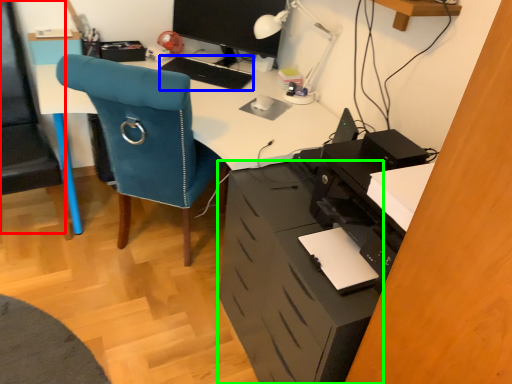
Question: Based on their relative distances, which object is farther from computer chair (highlighted by a red box)? Choose from keyboard (highlighted by a blue box) and file cabinet (highlighted by a green box).

Choices:
 (A) keyboard
 (B) file cabinet

Answer: (B)